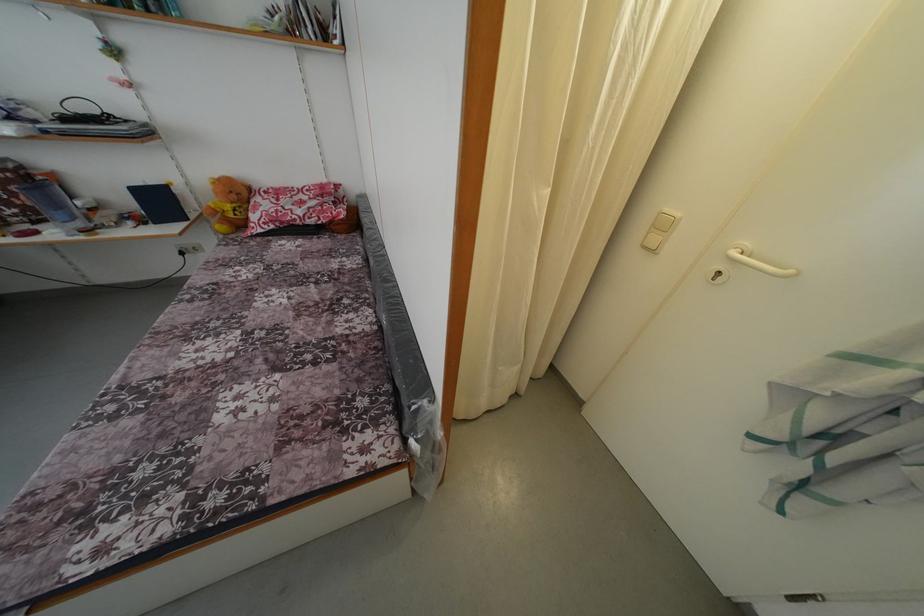
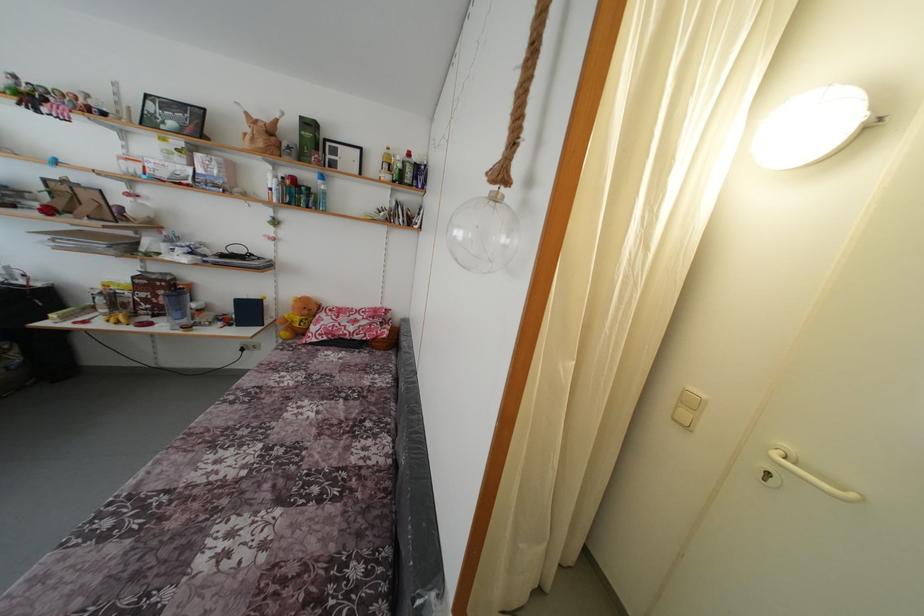
Question: How did the camera likely rotate?

Choices:
 (A) Left
 (B) Right
 (C) Up
 (D) Down

Answer: (C)